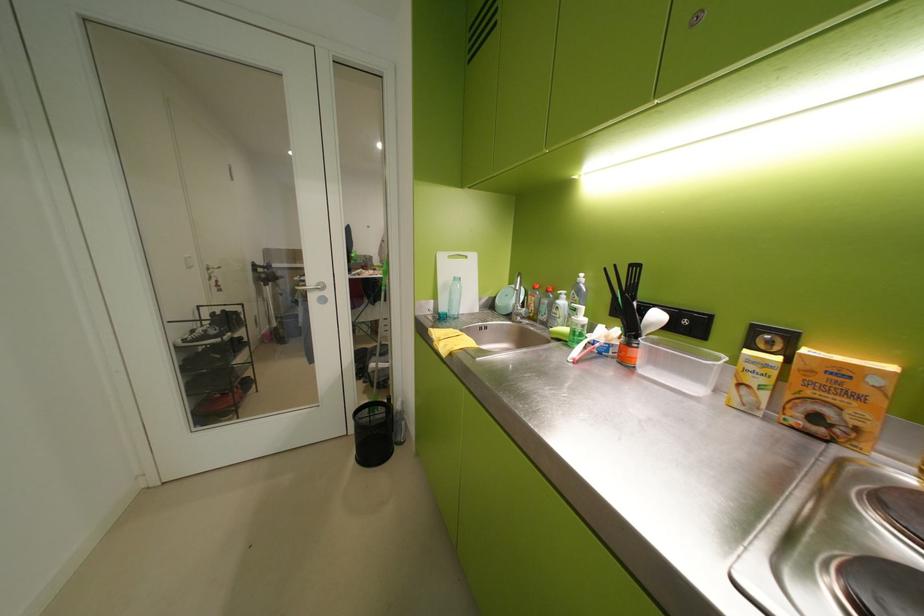
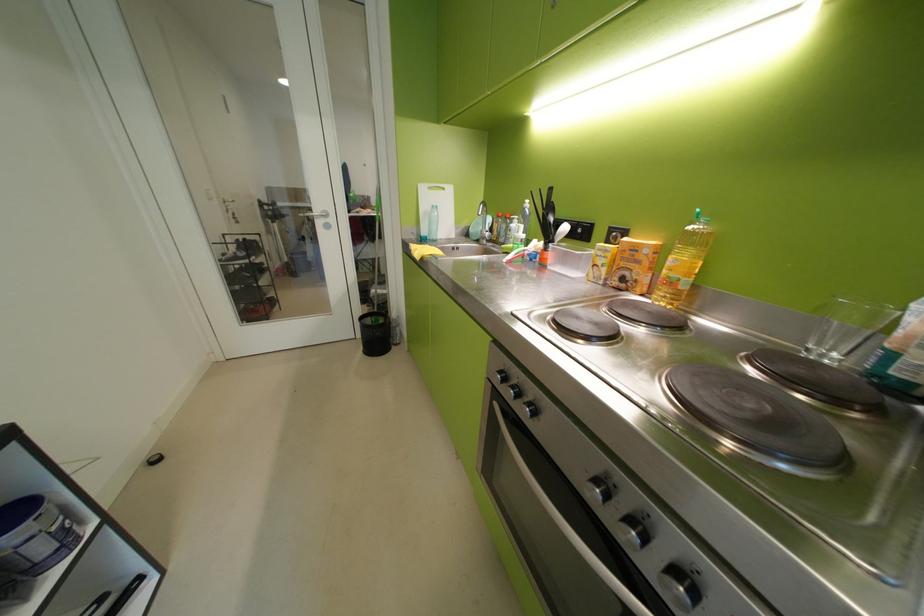
In the second image, find the point that corresponds to point (453, 310) in the first image.

(433, 233)